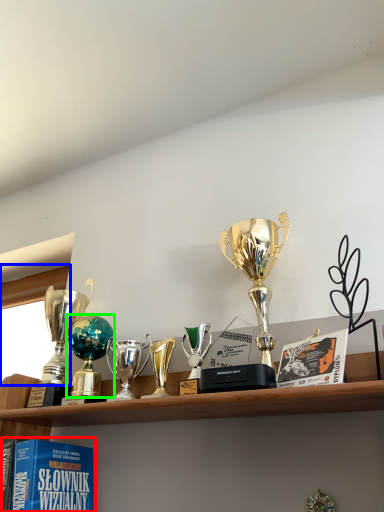
Question: Considering the real-world distances, which object is farthest from book (highlighted by a red box)? window screen (highlighted by a blue box) or trophy (highlighted by a green box)?

Choices:
 (A) window screen
 (B) trophy

Answer: (A)